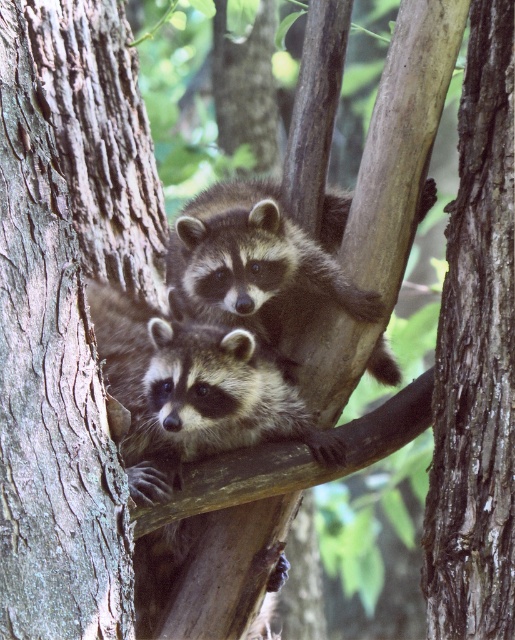
You are a photographer trying to capture both the smooth brown bark at left and the dark brown fur raccoon at center in the same frame. Based on their positions, which object should you adjust your camera to focus on first to ensure both are in the frame?

You should focus on the smooth brown bark at left first because it is positioned to the left of the dark brown fur raccoon at center, so adjusting the frame to include the leftmost object ensures the raccoon at center will also be included.

You are standing at a point 3.93 meters away from the point at coordinate (486,621). If you want to throw a small pebble to hit the raccoon in the foreground, which is lower on the branch, and the raccoon behind it, which is higher up, which raccoon would you aim for if you can only throw the pebble to a maximum distance of 3.9 meters?

You should aim for the raccoon in the foreground because it is closer to you than the raccoon behind it, and your maximum throw distance is 3.9 meters, which is slightly less than the 3.93 meters to the point. However, since the foreground raccoon is lower on the branch and likely closer than the point, it might be within reach.

You are a photographer aiming to capture a closeup of the brown rough bark tree trunk at center. You have a camera with a zoom lens that can focus on a specific point. The point you want to focus on is point (476, 358). Is this point located on the brown rough bark tree trunk at center?

Yes, the point (476, 358) is located on the brown rough bark tree trunk at center according to the provided information.